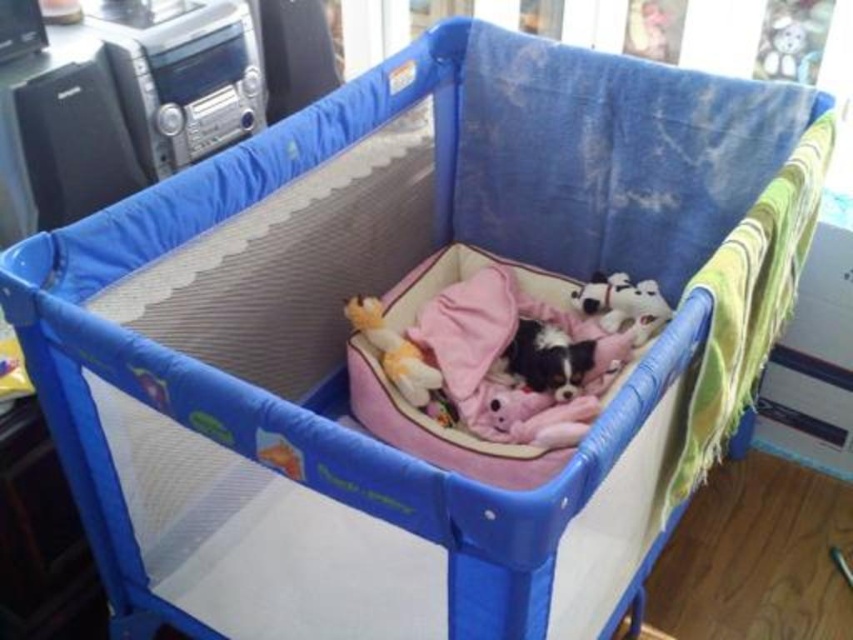
Between point (808, 36) and point (357, 296), which one is positioned behind?

Positioned behind is point (808, 36).

Is white plush bear at upper right taller than soft plush toy at center?

Incorrect, white plush bear at upper right's height is not larger of soft plush toy at center's.

Who is more forward, (799, 76) or (434, 392)?

Point (434, 392)

The image size is (853, 640). What are the coordinates of `white plush bear at upper right` in the screenshot? It's located at (791, 38).

Can you confirm if white plush bear at upper right is positioned to the left of white plush dog at upper right?

In fact, white plush bear at upper right is to the right of white plush dog at upper right.

Between point (805, 81) and point (636, 285), which one is positioned behind?

The point (805, 81) is more distant.

Is point (788, 68) closer to camera compared to point (641, 289)?

No, (788, 68) is behind (641, 289).

Find the location of a particular element. Image resolution: width=853 pixels, height=640 pixels. white plush bear at upper right is located at coordinates (791, 38).

Who is more forward, (x=351, y=310) or (x=612, y=320)?

Point (x=351, y=310) is more forward.

Which is behind, point (384, 342) or point (590, 285)?

Point (590, 285)

Find the location of `soft plush toy at center`. soft plush toy at center is located at coordinates (393, 353).